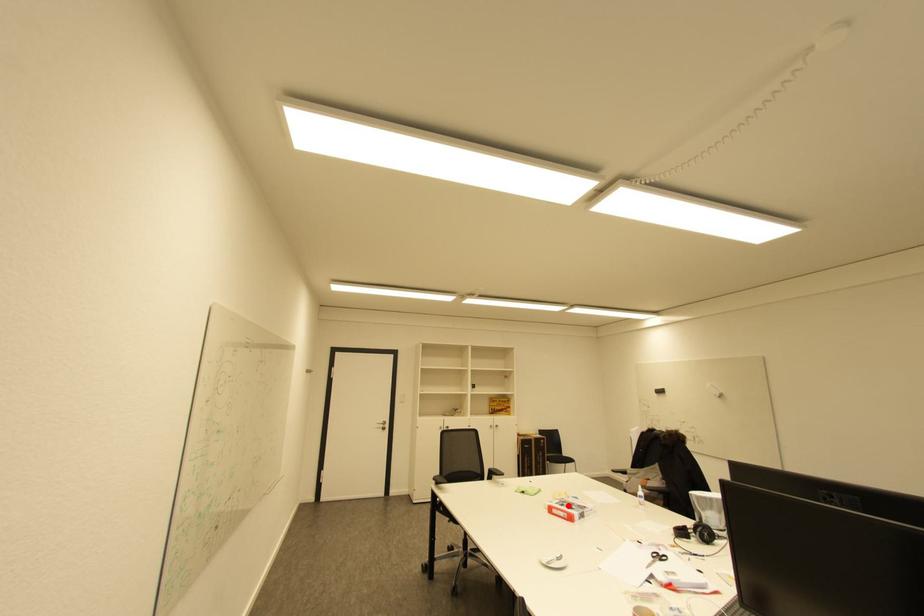
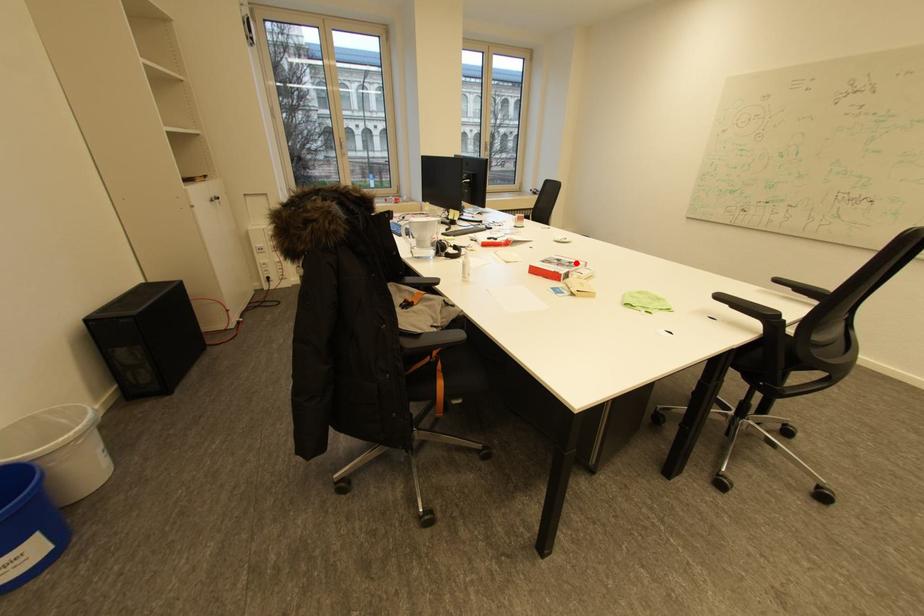
I am providing you with two images of the same scene from different viewpoints. A red point is marked on the first image and another point is marked on the second image. Is the marked point in image1 the same physical position as the marked point in image2?

Yes